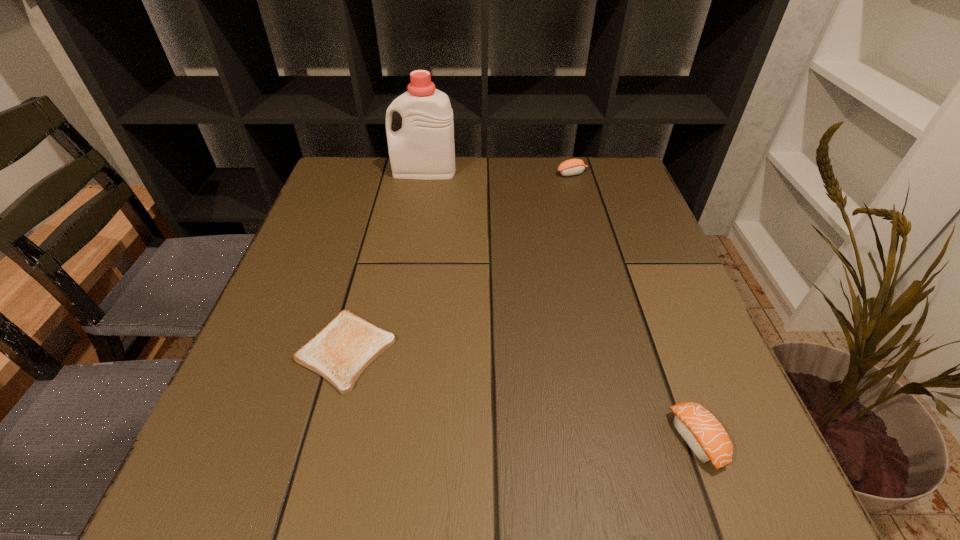
Identify the location of free point that satisfies the following two spatial constraints: 1. on the back side of the toast; 2. on the right side of the farther sushi. The height and width of the screenshot is (540, 960). 393,173.